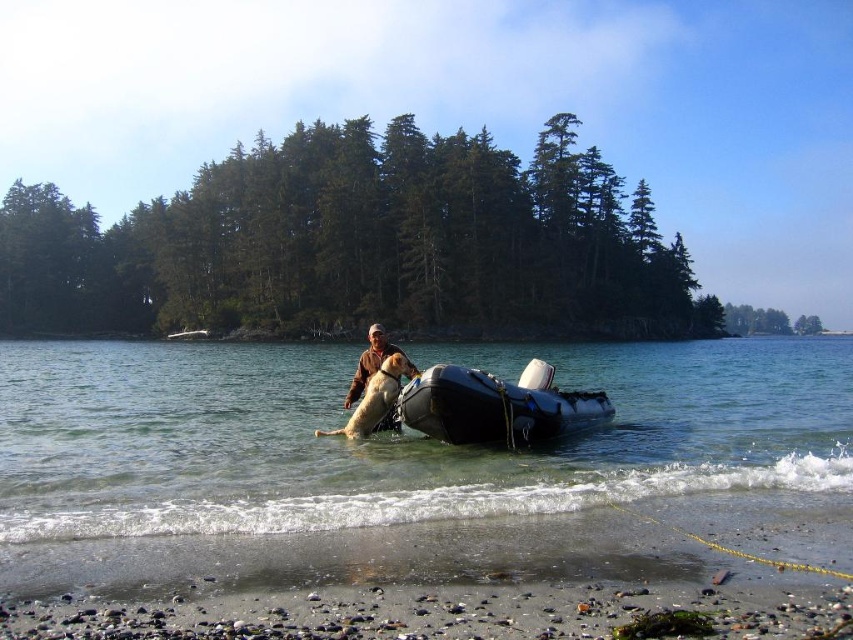
Question: Can you confirm if clear rubber boat at center is positioned below brown leather jacket at center?

Choices:
 (A) no
 (B) yes

Answer: (B)

Question: Observing the image, what is the correct spatial positioning of clear rubber boat at center in reference to black rubber boat at center?

Choices:
 (A) above
 (B) below

Answer: (B)

Question: Which object is the farthest from the black rubber boat at center?

Choices:
 (A) brown leather jacket at center
 (B) clear rubber boat at center

Answer: (B)

Question: Does clear rubber boat at center appear on the right side of brown leather jacket at center?

Choices:
 (A) yes
 (B) no

Answer: (A)

Question: Among these points, which one is farthest from the camera?

Choices:
 (A) (527, 394)
 (B) (361, 387)

Answer: (B)

Question: Based on their relative distances, which object is nearer to the brown leather jacket at center?

Choices:
 (A) clear rubber boat at center
 (B) black rubber boat at center

Answer: (B)